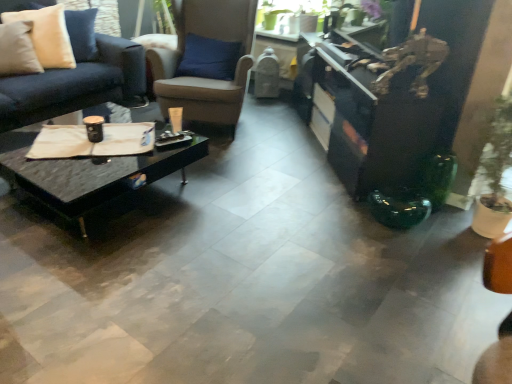
Question: Is point (180, 145) positioned closer to the camera than point (219, 110)?

Choices:
 (A) farther
 (B) closer

Answer: (B)

Question: Relative to brown leather chair at center, is black marble coffee table at center in front or behind?

Choices:
 (A) front
 (B) behind

Answer: (A)

Question: Based on their relative distances, which object is nearer to the beige fabric pillow at upper left?

Choices:
 (A) black glossy entertainment center at right
 (B) brown leather chair at center
 (C) black marble coffee table at center

Answer: (B)

Question: Which object is the closest to the black glossy entertainment center at right?

Choices:
 (A) brown leather chair at center
 (B) black marble coffee table at center
 (C) beige fabric pillow at upper left

Answer: (A)